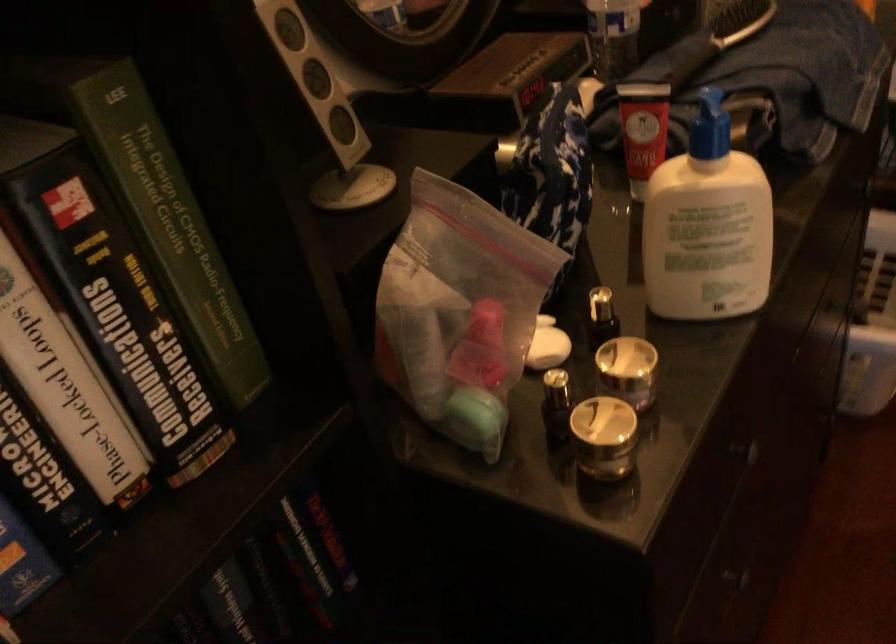
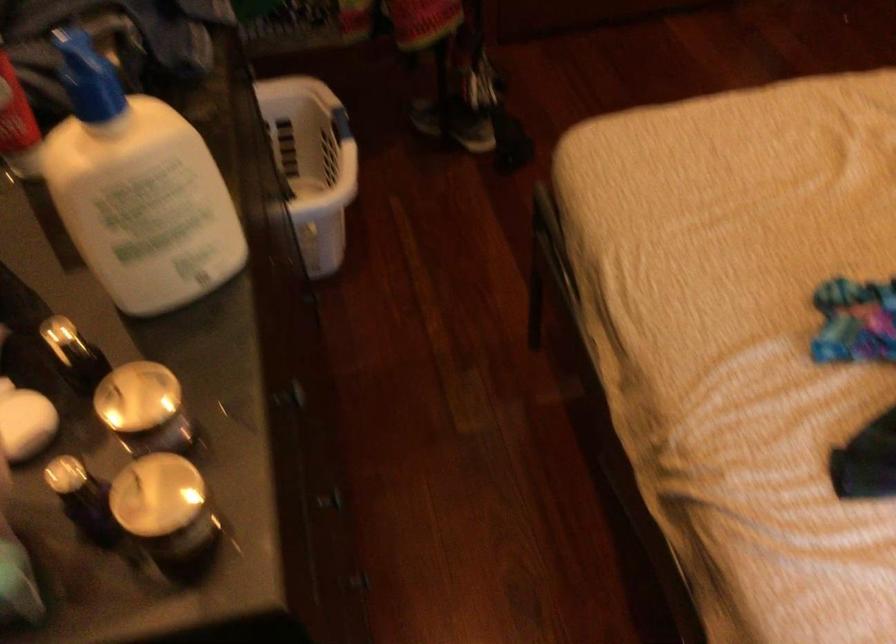
In the second image, find the point that corresponds to the point at 700,127 in the first image.

(88, 77)